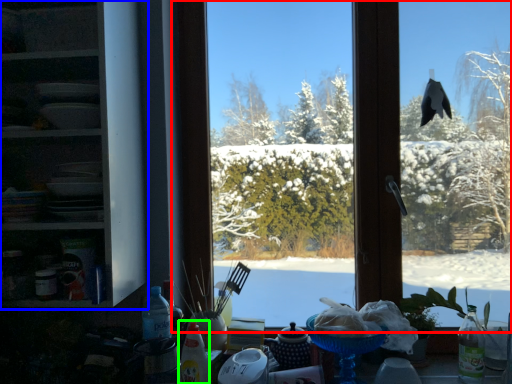
Question: Considering the real-world distances, which object is closest to window (highlighted by a red box)? shelf (highlighted by a blue box) or bottle (highlighted by a green box).

Choices:
 (A) shelf
 (B) bottle

Answer: (A)